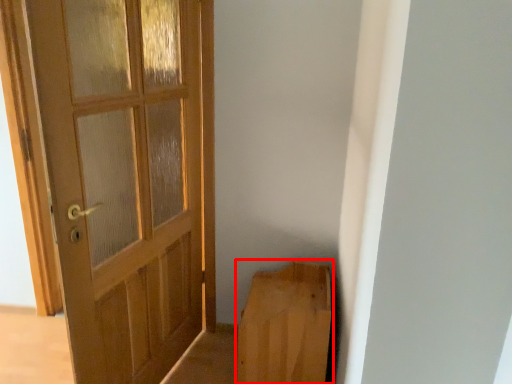
Question: From the image, what is the correct spatial relationship of furniture (annotated by the red box) in relation to door?

Choices:
 (A) right
 (B) left

Answer: (A)